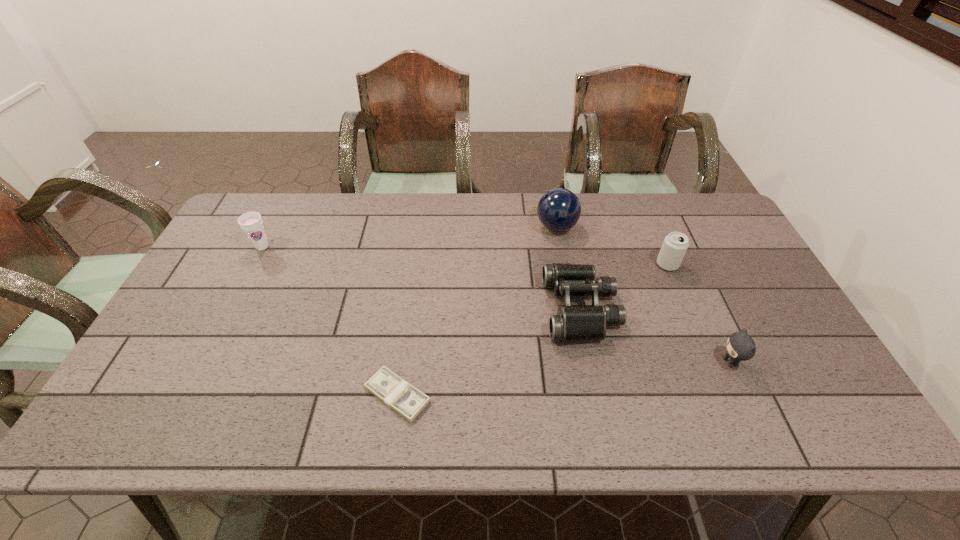
Find the location of `free space between the tallest object and the second object from left to right`. free space between the tallest object and the second object from left to right is located at coordinates (477, 311).

The image size is (960, 540). I want to click on vacant space in between the kitten and the tallest object, so click(643, 294).

What are the coordinates of `free space between the binoculars and the leftmost object` in the screenshot? It's located at (421, 278).

Where is `vacant region between the dollar and the can`? vacant region between the dollar and the can is located at coordinates (533, 329).

The height and width of the screenshot is (540, 960). Identify the location of free space between the leftmost object and the bowling ball. (409, 237).

Find the location of a particular element. Image resolution: width=960 pixels, height=540 pixels. unoccupied position between the kitten and the bowling ball is located at coordinates (643, 294).

Where is `object that is the fourth closest to the binoculars`? This screenshot has width=960, height=540. object that is the fourth closest to the binoculars is located at coordinates (395, 392).

I want to click on object that is the third closest to the cup, so click(572, 323).